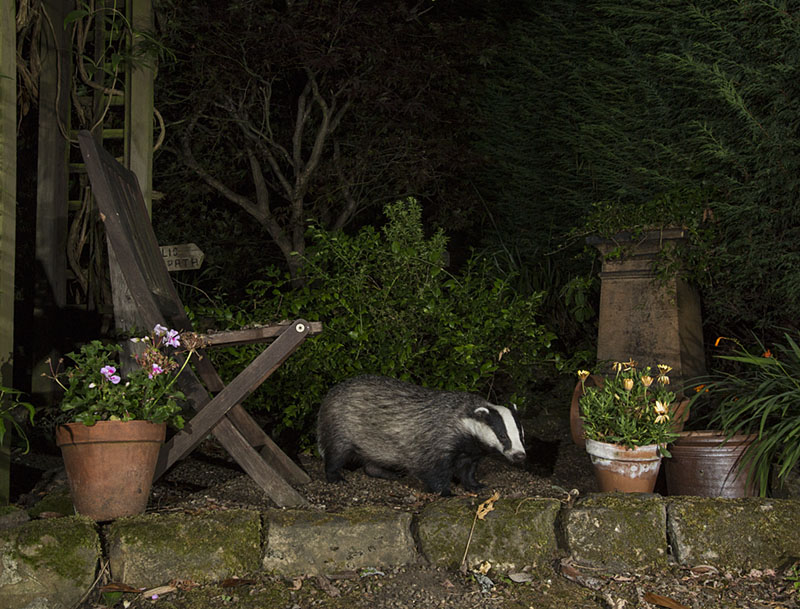
Identify the location of legs on a wooden chair. This screenshot has width=800, height=609. (208, 418), (234, 440), (250, 434).